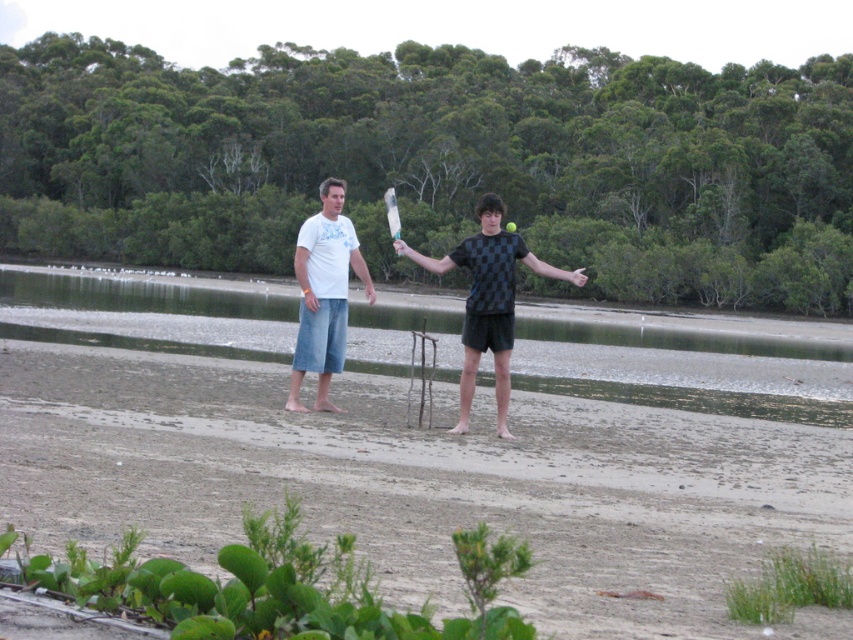
Question: Which object is positioned farthest from the matte white t-shirt at center?

Choices:
 (A) brown sandy beach at center
 (B) white cotton t-shirt at center
 (C) clear water at center

Answer: (C)

Question: Considering the relative positions of brown sandy beach at center and matte white t-shirt at center in the image provided, where is brown sandy beach at center located with respect to matte white t-shirt at center?

Choices:
 (A) below
 (B) above

Answer: (A)

Question: Which of the following is the closest to the observer?

Choices:
 (A) (193, 312)
 (B) (370, 456)
 (C) (514, 253)

Answer: (B)

Question: Can you confirm if brown sandy beach at center is thinner than clear water at center?

Choices:
 (A) no
 (B) yes

Answer: (B)

Question: Which point is closer to the camera?

Choices:
 (A) brown sandy beach at center
 (B) white cotton t-shirt at center
 (C) clear water at center
 (D) matte white t-shirt at center

Answer: (A)

Question: Does matte white t-shirt at center appear on the right side of white cotton t-shirt at center?

Choices:
 (A) yes
 (B) no

Answer: (A)